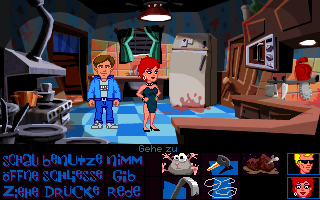
Image resolution: width=320 pixels, height=200 pixels. I want to click on tan refrigerator, so click(x=193, y=63).